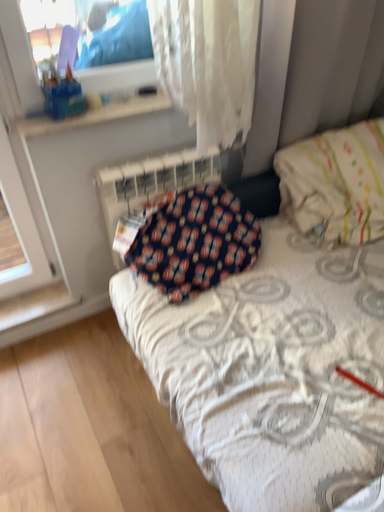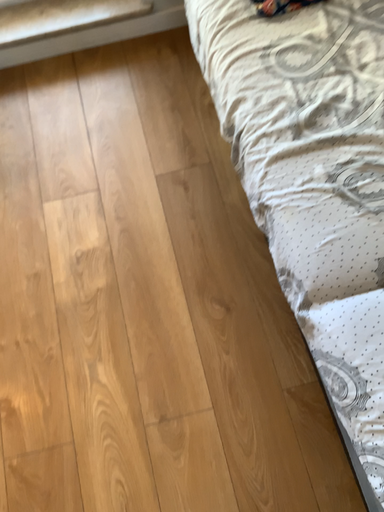
Question: Which way did the camera rotate in the video?

Choices:
 (A) rotated downward
 (B) rotated upward

Answer: (A)